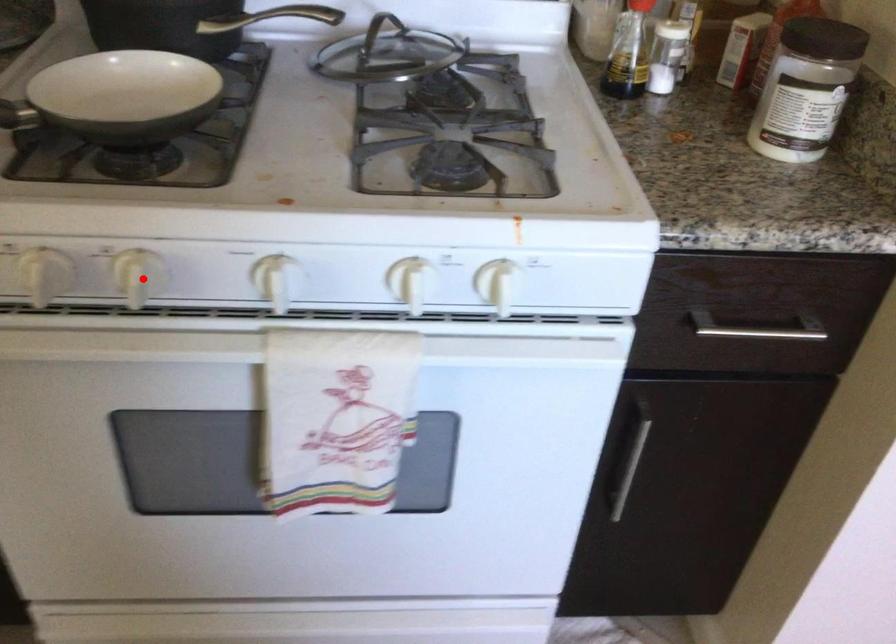
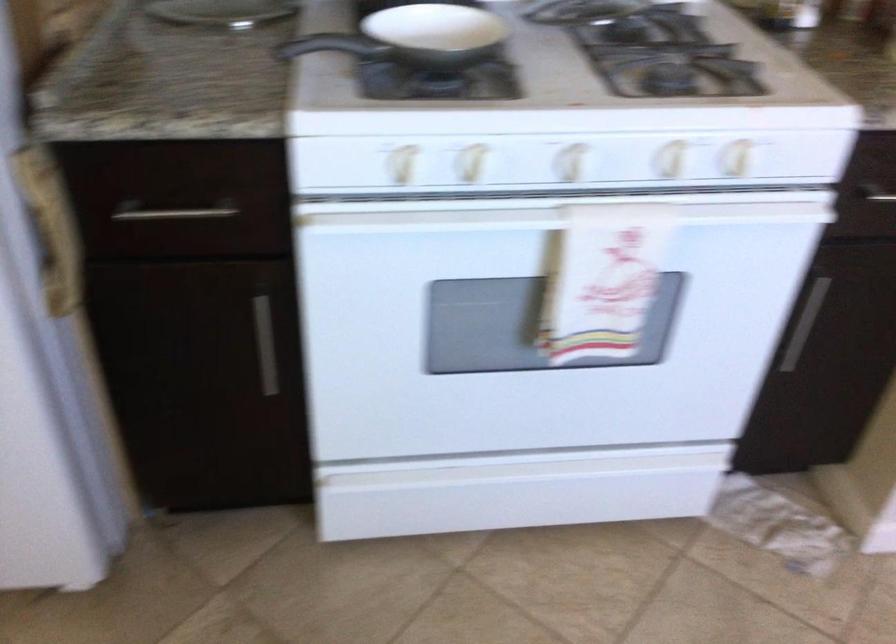
Question: A red point is marked in image1. In image2, is the corresponding 3D point closer to the camera or farther? Reply with the corresponding letter.

Choices:
 (A) The corresponding 3D point is closer.
 (B) The corresponding 3D point is farther.

Answer: (B)